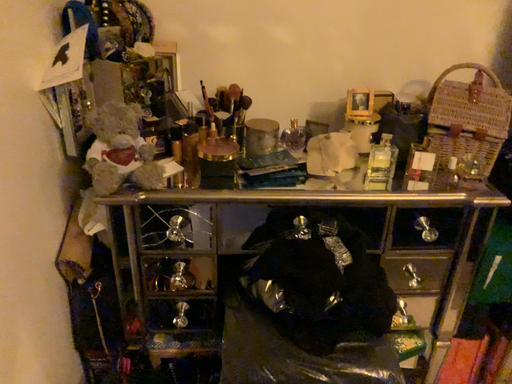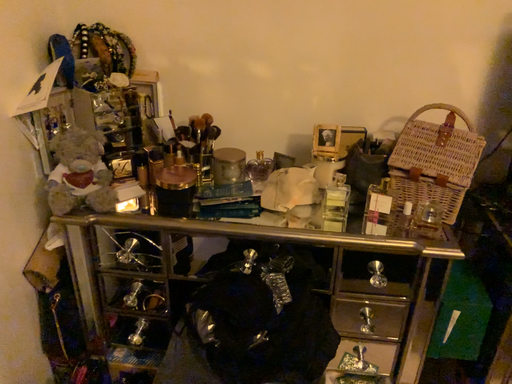
Question: How did the camera likely rotate when shooting the video?

Choices:
 (A) rotated left
 (B) rotated right

Answer: (A)